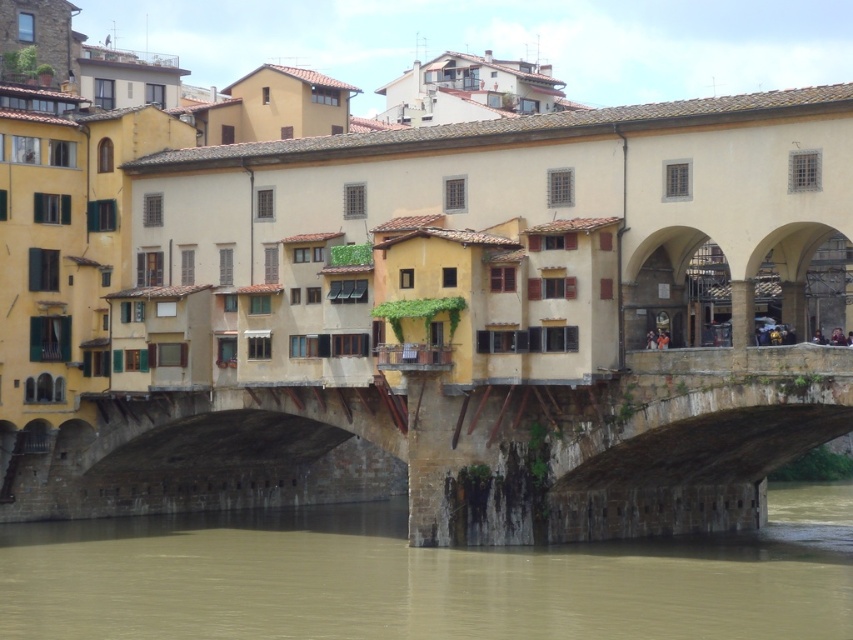
Is the position of stone bridge at center more distant than that of brown muddy water at lower center?

That is True.

How much distance is there between stone bridge at center and brown muddy water at lower center?

A distance of 6.62 meters exists between stone bridge at center and brown muddy water at lower center.

Find the location of `stone bridge at center`. stone bridge at center is located at coordinates (466, 451).

Locate an element on the screen. Image resolution: width=853 pixels, height=640 pixels. stone bridge at center is located at coordinates (466, 451).